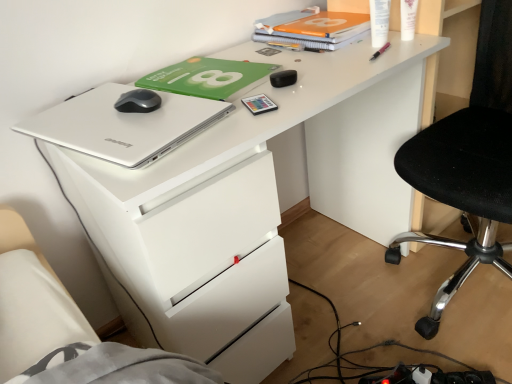
Locate an element on the screen. This screenshot has width=512, height=384. free space between orange matte notebook at upper center and green matte paperback book at upper center is located at coordinates (264, 55).